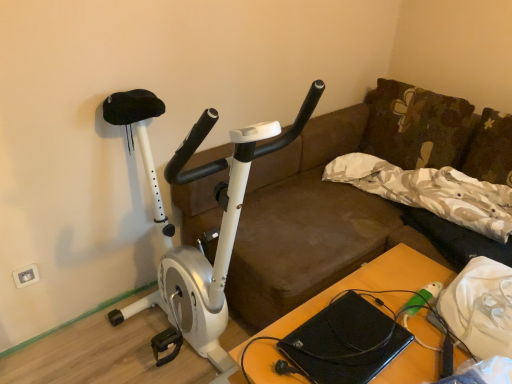
Identify the location of free area below black matte laptop at lower center (from a real-world perspective). Image resolution: width=512 pixels, height=384 pixels. (356, 334).